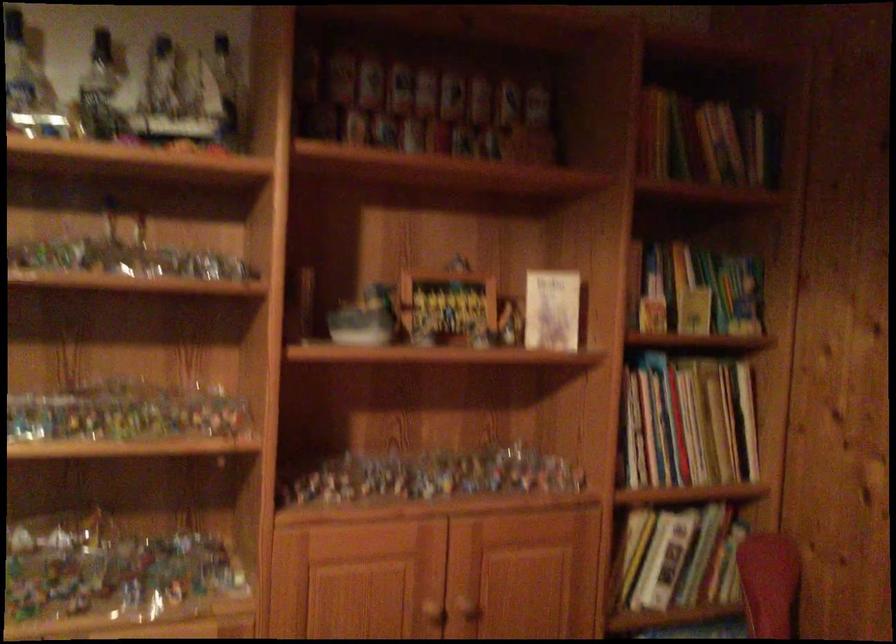
From the picture: First-person continuous shooting, in which direction is the camera rotating?

The camera's rotation is toward left-down.